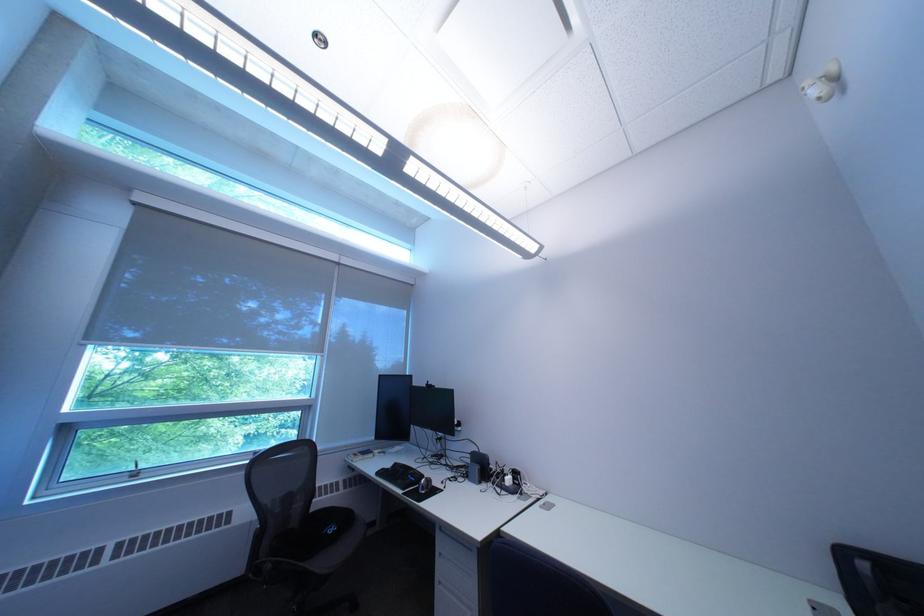
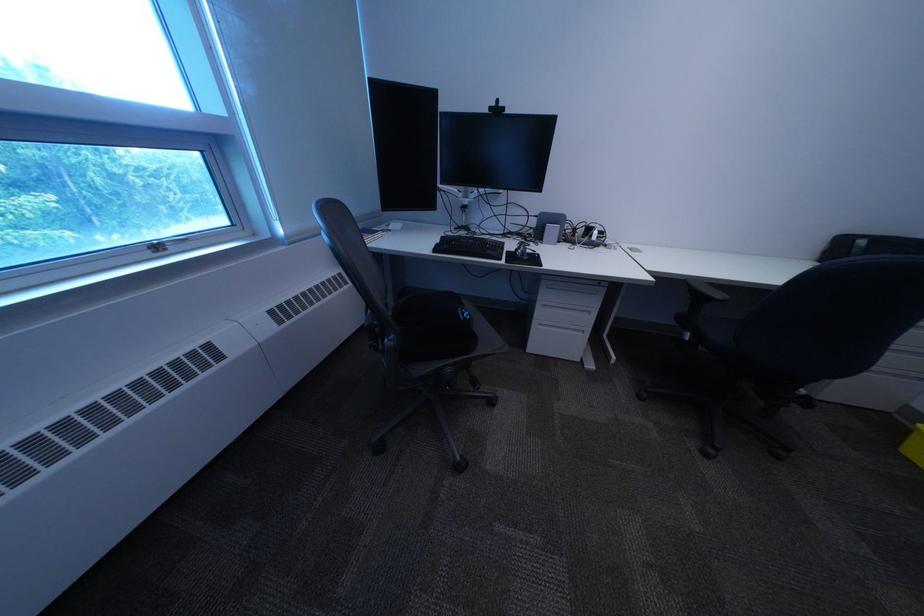
The point at (393, 475) is marked in the first image. Where is the corresponding point in the second image?

(451, 252)